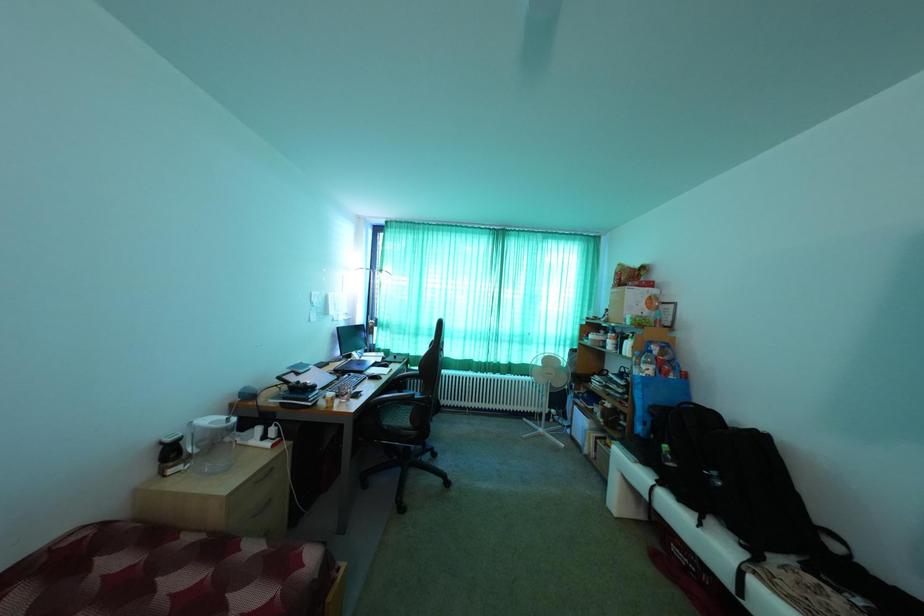
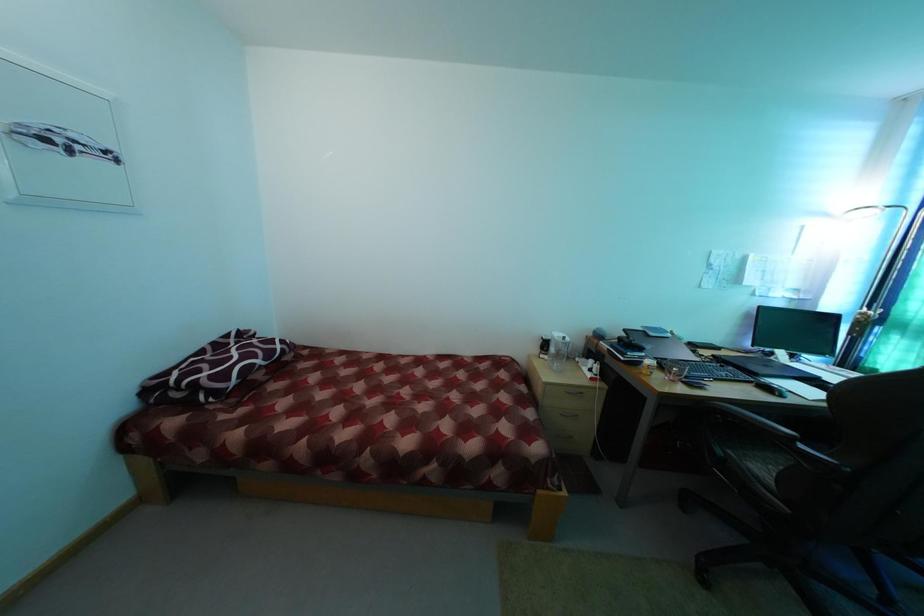
Question: The camera is either moving clockwise (left) or counter-clockwise (right) around the object. The first image is from the beginning of the video and the second image is from the end. Is the camera moving left or right when shooting the video?

Choices:
 (A) Left
 (B) Right

Answer: (B)